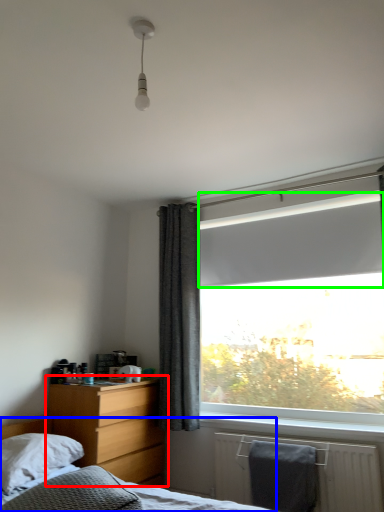
Question: Considering the real-world distances, which object is farthest from nightstand (highlighted by a red box)? bed (highlighted by a blue box) or window screen (highlighted by a green box)?

Choices:
 (A) bed
 (B) window screen

Answer: (B)